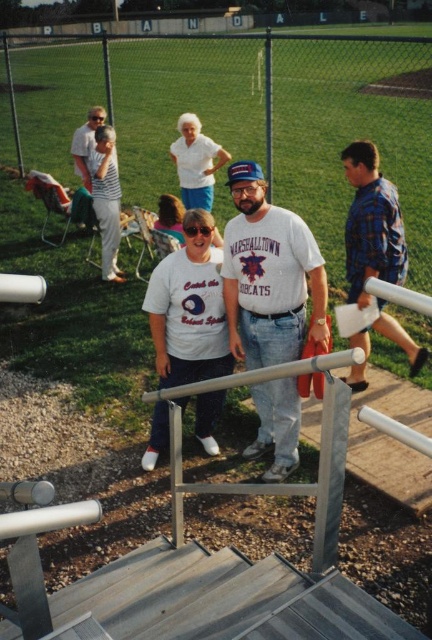
Can you confirm if white cotton t-shirt at center is shorter than blue plaid shirt at right?

Incorrect, white cotton t-shirt at center's height does not fall short of blue plaid shirt at right's.

Between point (256, 388) and point (378, 202), which one is positioned in front?

Point (256, 388) is in front.

Between point (314, 301) and point (368, 189), which one is positioned behind?

Positioned behind is point (368, 189).

Where is `white cotton t-shirt at center`? white cotton t-shirt at center is located at coordinates (269, 275).